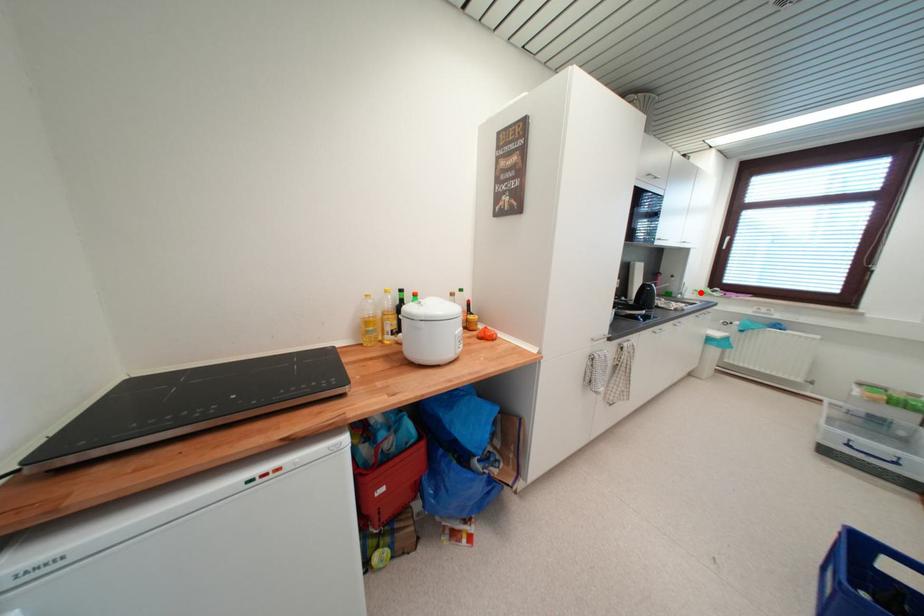
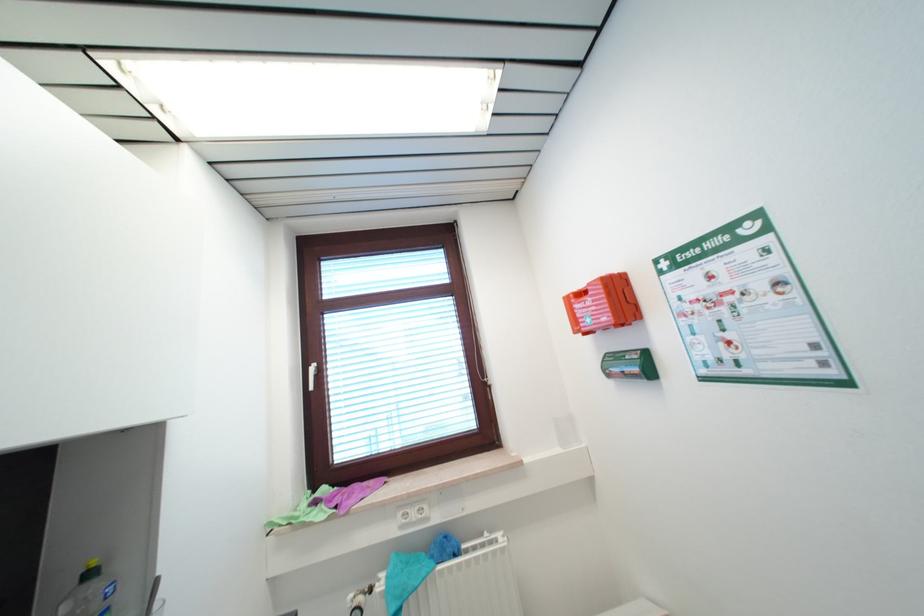
Where in the second image is the point corresponding to the highlighted location from the first image?

(274, 525)